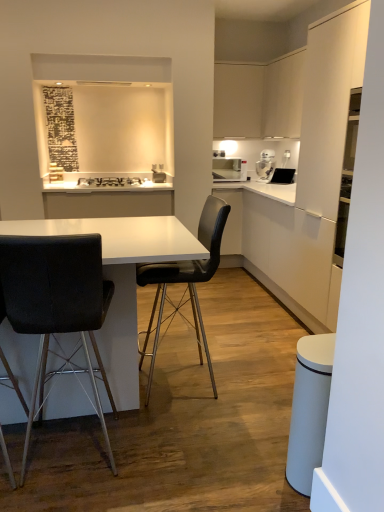
Find the location of a particular element. vacant space in front of black leather chair at center, the 2th chair positioned from the left is located at coordinates (195, 424).